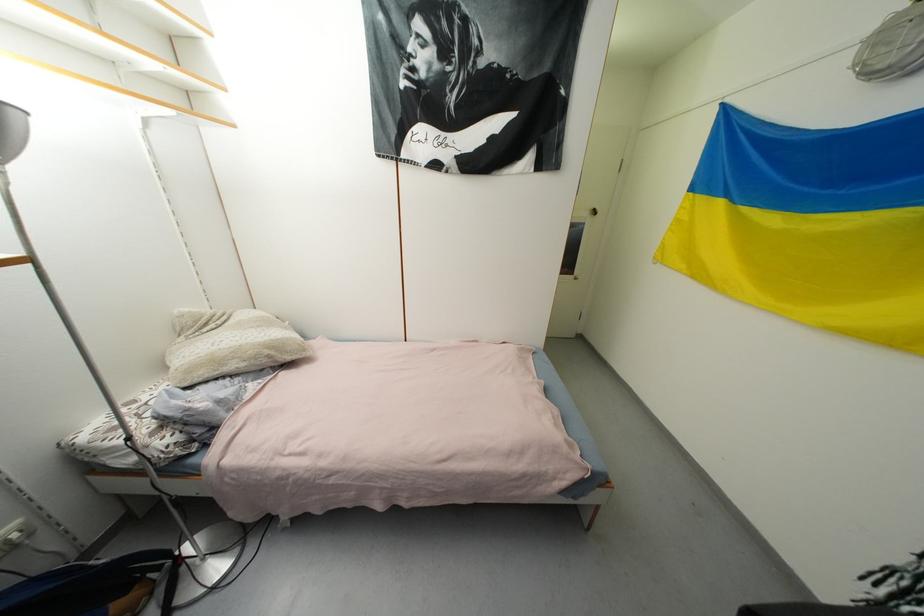
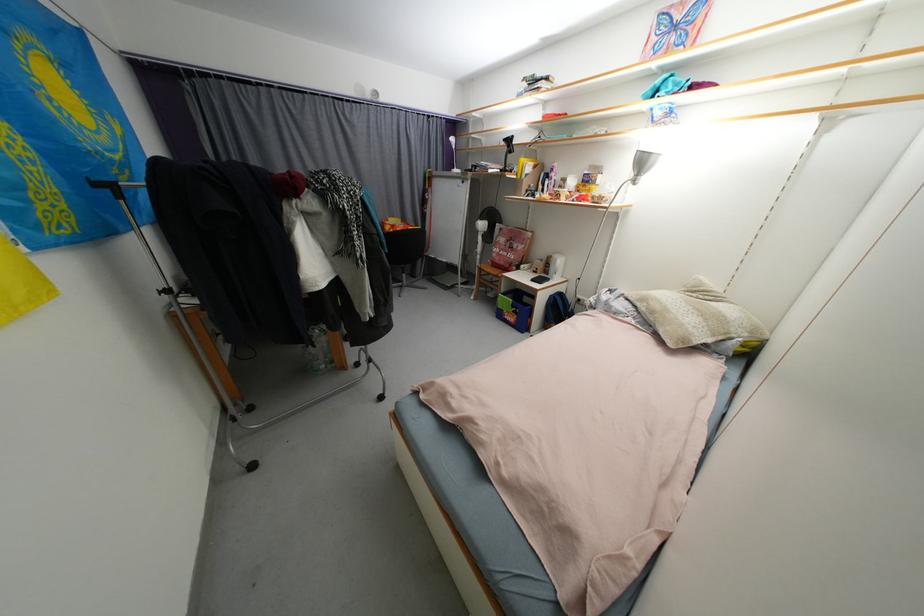
In the second image, find the point that corresponds to (x=261, y=359) in the first image.

(658, 314)